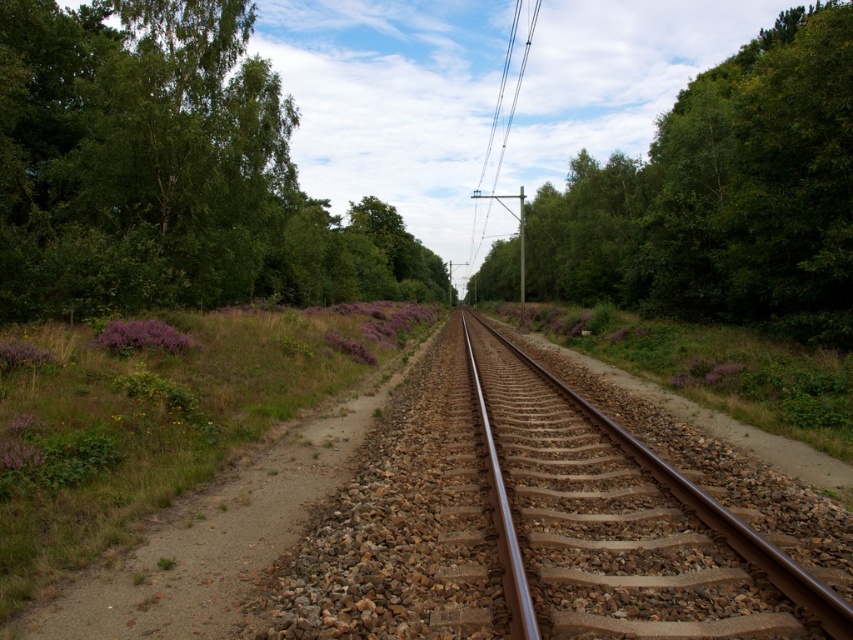
You are a hiker standing at the smooth wooden pole at center and want to take a photo of the green leafy tree at upper right. Which direction should you face to capture the tree in your shot?

The green leafy tree at upper right is positioned on the right side of the smooth wooden pole at center, so you should face to the right to capture the tree in your shot.

Based on the photo, you are standing at the origin point of the image, which is the bottom left corner. You want to walk towards the green leafy tree at upper right. What direction should you head in?

To reach the green leafy tree at upper right from the origin point at the bottom left corner, you should head northeast, as the tree is located at coordinates approximately 0.306 on the x and 0.848 on the y axis.